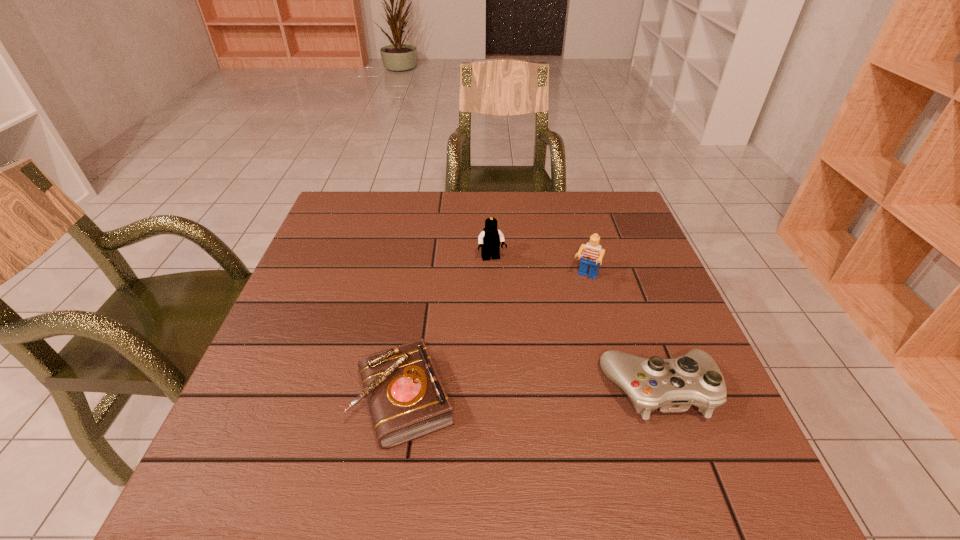
Where is `free spot on the desktop that is between the leftmost object and the control and is positioned on the front-facing side of the farthest object`? The image size is (960, 540). free spot on the desktop that is between the leftmost object and the control and is positioned on the front-facing side of the farthest object is located at coordinates (536, 394).

What are the coordinates of `free space on the desktop that is between the diary and the control and is positioned on the face of the right Lego` in the screenshot? It's located at (536, 394).